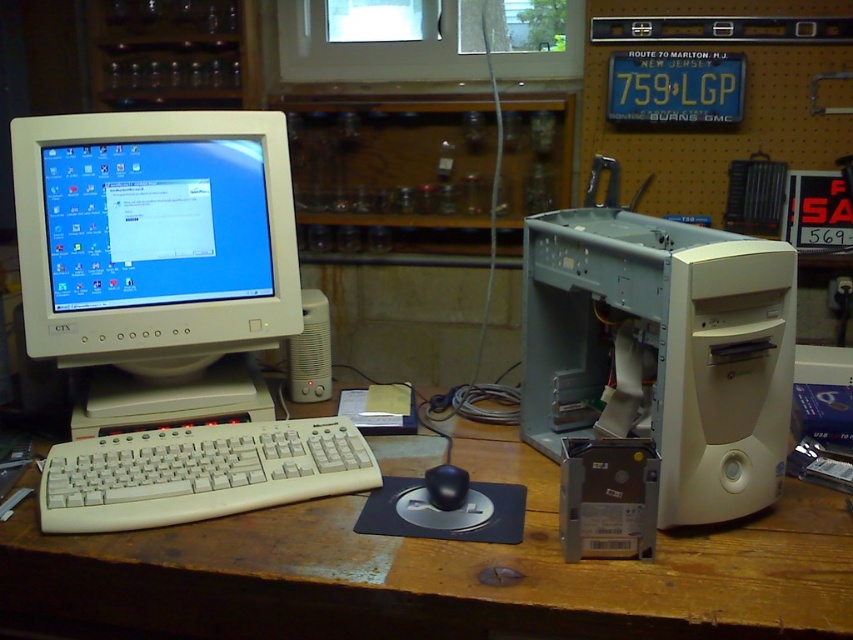
Question: Can you confirm if white wood computer desk at center is positioned to the right of white plastic keyboard at lower left?

Choices:
 (A) no
 (B) yes

Answer: (B)

Question: Is white plastic keyboard at lower left below black plastic mouse at center?

Choices:
 (A) no
 (B) yes

Answer: (A)

Question: Considering the relative positions of matte white monitor at left and white plastic keyboard at lower left in the image provided, where is matte white monitor at left located with respect to white plastic keyboard at lower left?

Choices:
 (A) left
 (B) right

Answer: (A)

Question: Which point appears farthest from the camera in this image?

Choices:
 (A) (573, 346)
 (B) (149, 147)
 (C) (395, 458)
 (D) (439, 499)

Answer: (A)

Question: Which object is the closest to the black plastic mouse at center?

Choices:
 (A) white plastic keyboard at lower left
 (B) white wood computer desk at center
 (C) matte white monitor at left

Answer: (B)

Question: Which is farther from the matte white monitor at left?

Choices:
 (A) white plastic keyboard at lower left
 (B) white plastic computer case at center-right
 (C) black plastic mouse at center
 (D) white wood computer desk at center

Answer: (C)